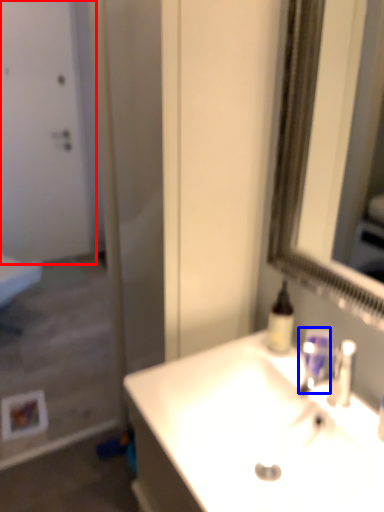
Question: Among these objects, which one is nearest to the camera, door (highlighted by a red box) or mouthwash (highlighted by a blue box)?

Choices:
 (A) door
 (B) mouthwash

Answer: (B)